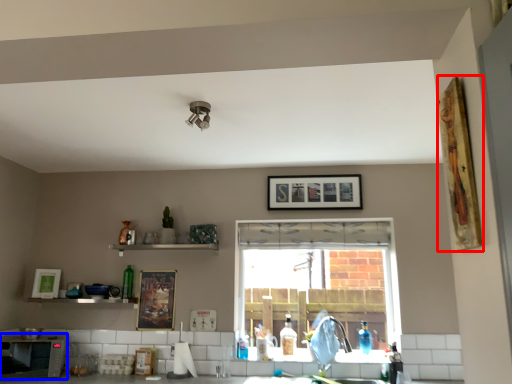
Question: Which object is further to the camera taking this photo, picture frame (highlighted by a red box) or appliance (highlighted by a blue box)?

Choices:
 (A) picture frame
 (B) appliance

Answer: (B)